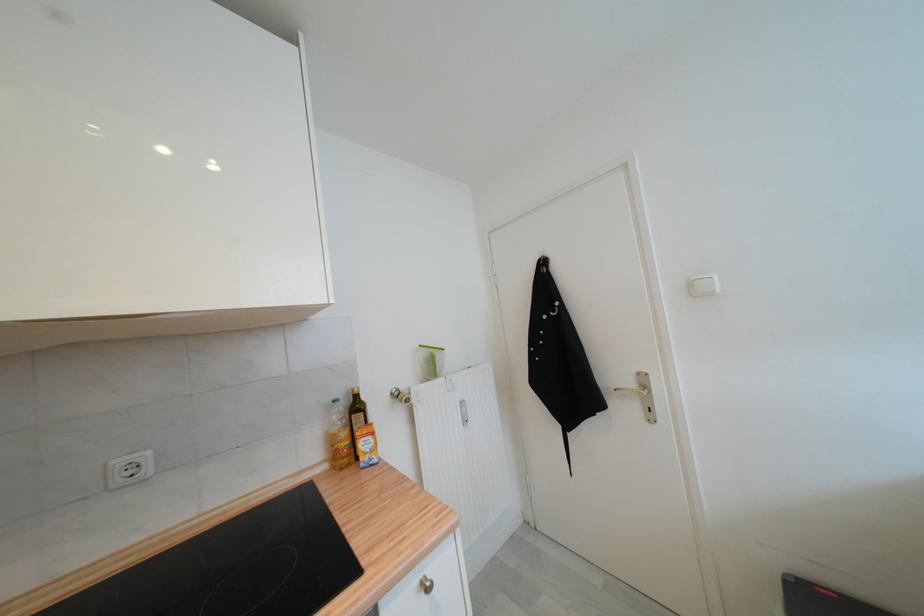
Where would you press the white light switch? Please return your answer as a coordinate pair (x, y).

(128, 469)